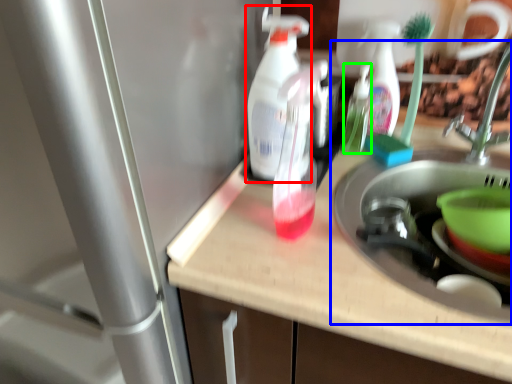
Question: Which object is the closest to the cleaning product (highlighted by a red box)? Choose among these: sink (highlighted by a blue box) or bottle (highlighted by a green box).

Choices:
 (A) sink
 (B) bottle

Answer: (B)